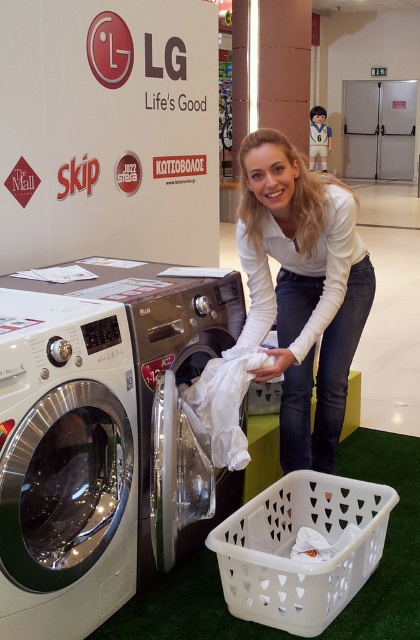
You are standing in front of the white glossy washing machine at center. Which direction should you move to reach the white glossy washing machine at lower left?

You should move to the left to reach the white glossy washing machine at lower left since it is positioned to the left of the white glossy washing machine at center.

You are a customer at the mall and you want to place a small bag on top of the white glossy washing machine at lower left. Can you confirm if there is enough space between the white fabric at lower center and the machine to place the bag?

The white glossy washing machine at lower left is much taller than the white fabric at lower center, so there is enough vertical space to place the bag on top of the machine.

You are a customer at the mall looking to purchase a washing machine. You see the white glossy washing machine at center and the white fabric at lower center. Which item is taller?

The white glossy washing machine at center is taller than the white fabric at lower center.